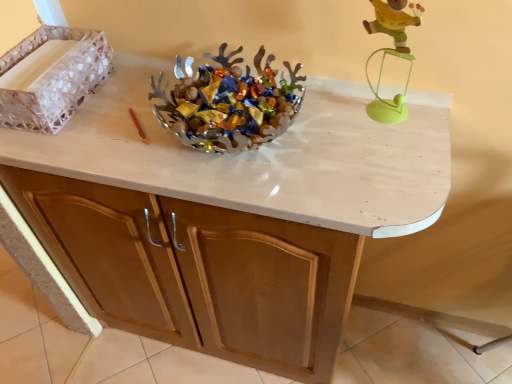
Where is `vacant space that is to the left of metallic silver bowl at center`? This screenshot has width=512, height=384. vacant space that is to the left of metallic silver bowl at center is located at coordinates (105, 127).